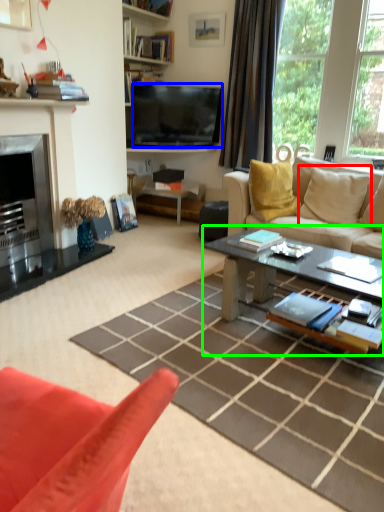
Question: Estimate the real-world distances between objects in this image. Which object is farther from pillow (highlighted by a red box), television (highlighted by a blue box) or coffee table (highlighted by a green box)?

Choices:
 (A) television
 (B) coffee table

Answer: (A)